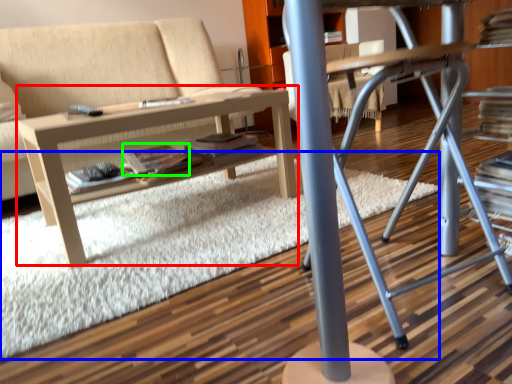
Question: Estimate the real-world distances between objects in this image. Which object is closer to table (highlighted by a red box), plain (highlighted by a blue box) or paperback book (highlighted by a green box)?

Choices:
 (A) plain
 (B) paperback book

Answer: (B)